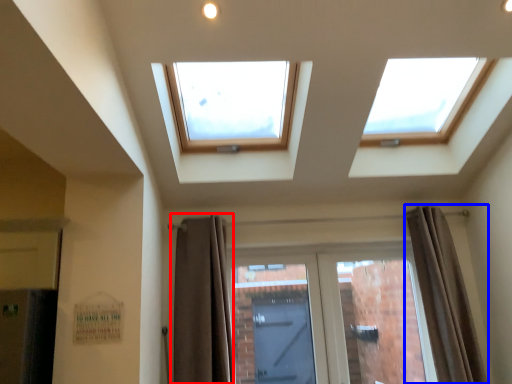
Question: Which object appears farthest to the camera in this image, curtain (highlighted by a red box) or curtain (highlighted by a blue box)?

Choices:
 (A) curtain
 (B) curtain

Answer: (B)